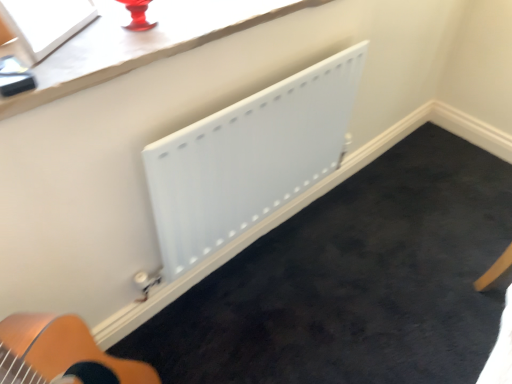
Question: Looking at the image, does white glossy window screen at upper left seem bigger or smaller compared to white matte radiator at center?

Choices:
 (A) big
 (B) small

Answer: (B)

Question: In terms of height, does white glossy window screen at upper left look taller or shorter compared to white matte radiator at center?

Choices:
 (A) tall
 (B) short

Answer: (B)

Question: From a real-world perspective, is white glossy window screen at upper left above or below white matte radiator at center?

Choices:
 (A) above
 (B) below

Answer: (A)

Question: Considering their positions, is white matte radiator at center located in front of or behind white glossy window screen at upper left?

Choices:
 (A) front
 (B) behind

Answer: (B)

Question: Is white matte radiator at center wider or thinner than white glossy window screen at upper left?

Choices:
 (A) wide
 (B) thin

Answer: (B)

Question: In terms of height, does white matte radiator at center look taller or shorter compared to white glossy window screen at upper left?

Choices:
 (A) tall
 (B) short

Answer: (A)

Question: Considering the positions of point (327, 76) and point (31, 38), is point (327, 76) closer or farther from the camera than point (31, 38)?

Choices:
 (A) closer
 (B) farther

Answer: (B)